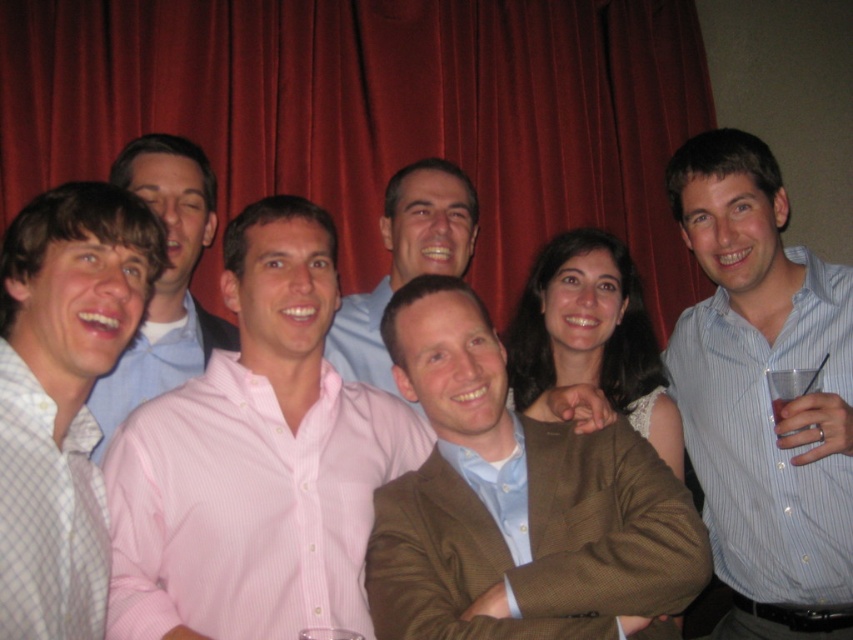
You are organizing a group photo and need to arrange the light blue checkered shirt at left and the pink striped shirt at left in a row based on their widths. Which shirt should be placed first if you want the narrower one on the left?

The light blue checkered shirt at left should be placed first on the left since it is thinner than the pink striped shirt at left.

You are standing at the origin point in the image. Which of the two points, point (142, 344) or point (368, 378), is closer to you?

Point (142, 344) is in front of point (368, 378), so it is closer to you.

You are standing in front of the image. If you want to find the light blue checkered shirt at left, where would you look?

The light blue checkered shirt at left is located at the 2D coordinates point [62,396] in the image.